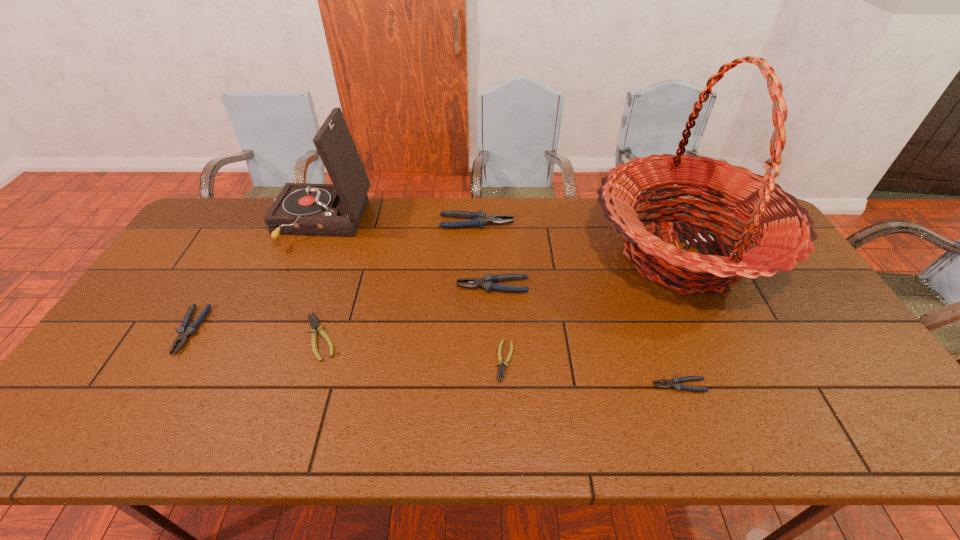
Where is `free space that is in between the smallest gray pliers and the phonograph record`? The height and width of the screenshot is (540, 960). free space that is in between the smallest gray pliers and the phonograph record is located at coordinates (500, 305).

Identify the location of empty space that is in between the phonograph record and the shortest pliers. This screenshot has height=540, width=960. (413, 293).

Image resolution: width=960 pixels, height=540 pixels. Find the location of `vacant space that's between the fourth tallest pliers and the right yellow pliers`. vacant space that's between the fourth tallest pliers and the right yellow pliers is located at coordinates (592, 373).

At what (x,y) coordinates should I click in order to perform the action: click on vacant point located between the phonograph record and the rightmost pliers. Please return your answer as a coordinate pair (x, y). Looking at the image, I should click on (500, 305).

Image resolution: width=960 pixels, height=540 pixels. I want to click on free space between the seventh tallest object and the shortest pliers, so click(x=413, y=349).

Find the location of a particular element. The height and width of the screenshot is (540, 960). vacant space in between the fifth shortest pliers and the phonograph record is located at coordinates (407, 255).

What are the coordinates of `free space that is in between the second pliers from left to right and the second smallest gray pliers` in the screenshot? It's located at (255, 334).

This screenshot has width=960, height=540. Identify the location of empty location between the third smallest gray pliers and the second tallest object. (407, 255).

You are a GUI agent. You are given a task and a screenshot of the screen. Output one action in this format:
    pyautogui.click(x=<x>, y=<y>)
    Task: Click on the object that is the fifth nearest to the tallest pliers
    
    Given the screenshot: What is the action you would take?
    pyautogui.click(x=501, y=370)

Locate an element on the screen. The height and width of the screenshot is (540, 960). the third closest object relative to the second pliers from left to right is located at coordinates (487, 282).